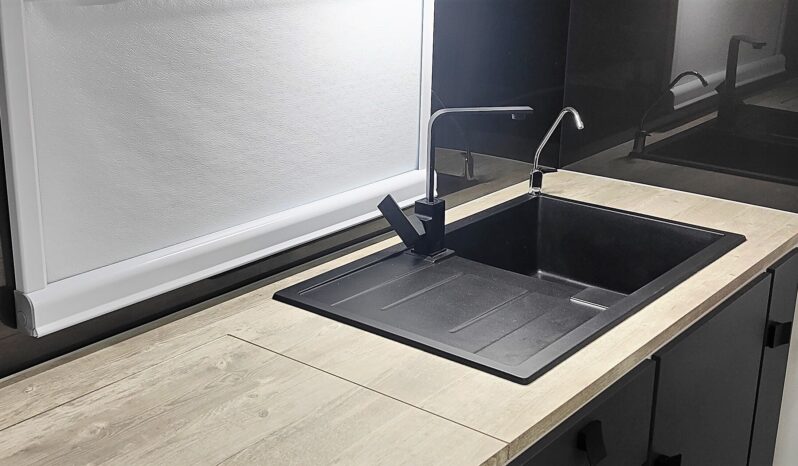
Locate an element on the screen. This screenshot has width=798, height=466. cabinets is located at coordinates (610, 426), (725, 349), (785, 290).